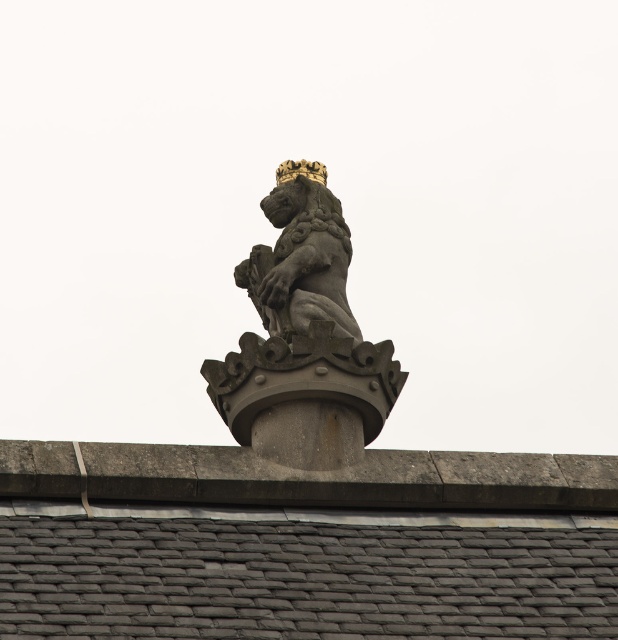
You are a contractor assessing the building structure. You notice the gray slate roof at center and the polished stone lion at center. Which object occupies a greater area on the roof?

The gray slate roof at center has a larger size compared to the polished stone lion at center, so it occupies a greater area on the roof.

You are an architect inspecting a building roof. You notice two lions, the dark gray stone lion at center and the polished stone lion at center. Which lion should you measure first to determine if they are the same size?

You should measure the dark gray stone lion at center first because it is larger than the polished stone lion at center, so if they are not the same size, the difference will be noticeable starting with the larger one.